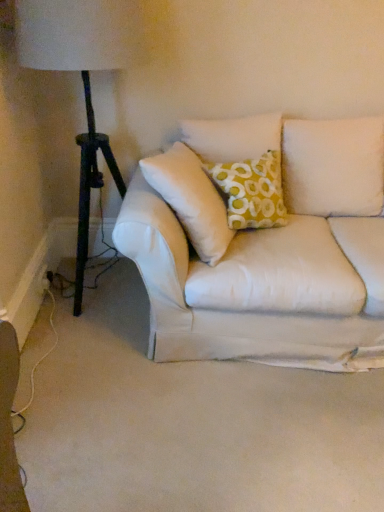
At what (x,y) coordinates should I click in order to perform the action: click on free area behind white plastic electric outlet at lower left. Please return your answer as a coordinate pair (x, y). Looking at the image, I should click on (56, 271).